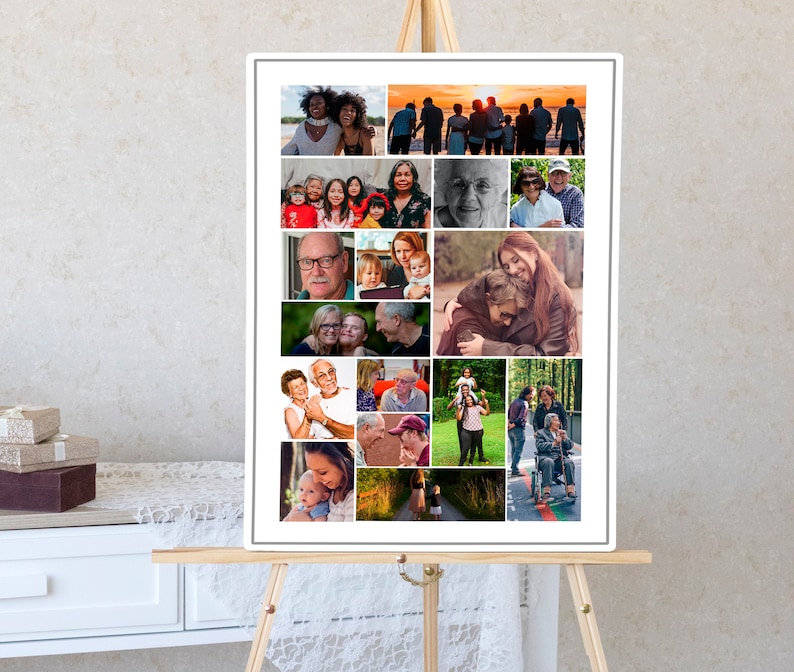
At what (x,y) coordinates should I click in order to perform the action: click on gray line on border of collage frame. Please return your answer as a coordinate pair (x, y). The image size is (794, 672). Looking at the image, I should click on (430, 58), (253, 282), (434, 542), (607, 278).